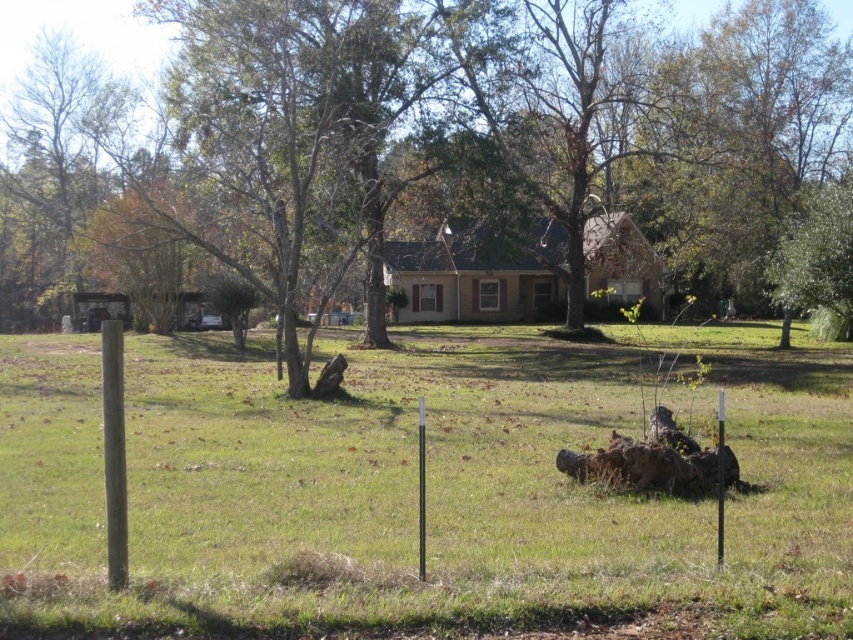
Question: Does green grass at center appear over brown wood tree at center?

Choices:
 (A) no
 (B) yes

Answer: (A)

Question: Can you confirm if green grass at center is thinner than brown wood tree at center?

Choices:
 (A) yes
 (B) no

Answer: (A)

Question: Is green grass at center to the left of brown wood tree at center from the viewer's perspective?

Choices:
 (A) no
 (B) yes

Answer: (A)

Question: Which point is farther from the camera taking this photo?

Choices:
 (A) (180, 388)
 (B) (671, 20)

Answer: (B)